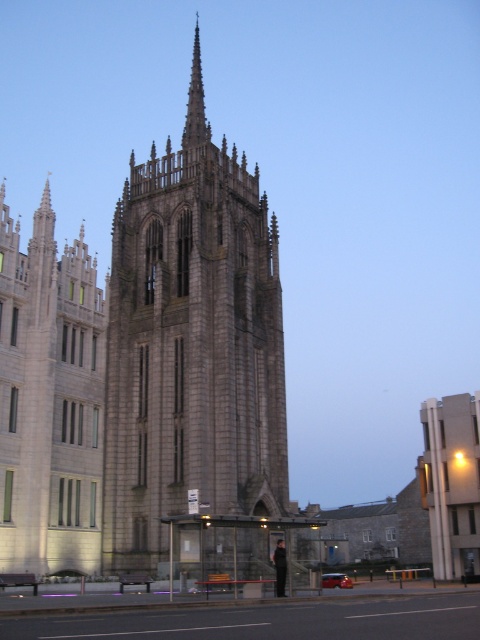
You are an architect analyzing the building structure. You notice the gray stone tower at center and the gray stone spire at center. Which one is bigger in size?

The gray stone tower at center is larger in size compared to the gray stone spire at center according to the description.

You are an urban planner assessing the space between two central structures in the image. The gray stone tower at center and the black leather jacket at center. Which one is wider?

The gray stone tower at center is wider than the black leather jacket at center, as its width surpasses the latter.